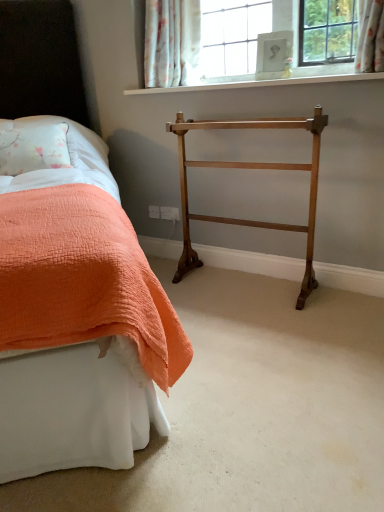
Question: From a real-world perspective, relative to floral fabric curtain at upper center, is white quilted fabric at left vertically above or below?

Choices:
 (A) below
 (B) above

Answer: (A)

Question: From the image's perspective, is white quilted fabric at left located above or below floral fabric curtain at upper center?

Choices:
 (A) above
 (B) below

Answer: (B)

Question: Which is nearer to the white painted wood at upper center?

Choices:
 (A) orange quilted bed at left
 (B) polished brass towel rack at center
 (C) floral fabric curtain at upper center
 (D) white quilted fabric at left

Answer: (C)

Question: Which object is the closest to the white quilted fabric at left?

Choices:
 (A) floral fabric curtain at upper center
 (B) polished brass towel rack at center
 (C) orange quilted bed at left
 (D) white painted wood at upper center

Answer: (C)